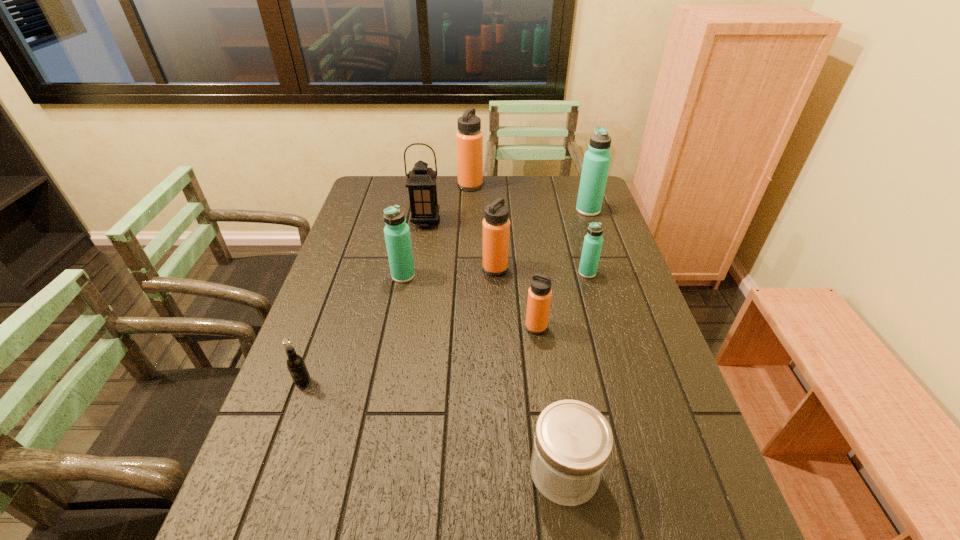
Select which thermos bottle appears as the second closest to the second smallest aqua thermos bottle. Please provide its 2D coordinates. Your answer should be formatted as a tuple, i.e. [(x, y)], where the tuple contains the x and y coordinates of a point satisfying the conditions above.

[(539, 294)]

Locate an element on the screen. This screenshot has height=540, width=960. orange thermos bottle that stands as the closest to the nearest orange thermos bottle is located at coordinates (496, 226).

I want to click on orange thermos bottle identified as the closest to the root beer, so click(539, 294).

Identify which aqua thermos bottle is the nearest to the second farthest thermos bottle. Please provide its 2D coordinates. Your answer should be formatted as a tuple, i.e. [(x, y)], where the tuple contains the x and y coordinates of a point satisfying the conditions above.

[(593, 241)]

Where is `aqua thermos bottle that stands as the second closest to the lantern`? aqua thermos bottle that stands as the second closest to the lantern is located at coordinates (593, 241).

The height and width of the screenshot is (540, 960). I want to click on free spot that satisfies the following two spatial constraints: 1. on the front side of the rightmost orange thermos bottle; 2. on the right side of the black lantern, so click(x=409, y=327).

Locate an element on the screen. This screenshot has width=960, height=540. vacant space that satisfies the following two spatial constraints: 1. on the front side of the lantern; 2. on the right side of the smallest aqua thermos bottle is located at coordinates (418, 273).

Locate an element on the screen. free space that satisfies the following two spatial constraints: 1. on the label of the leftmost object; 2. on the right side of the jar is located at coordinates (271, 471).

You are a GUI agent. You are given a task and a screenshot of the screen. Output one action in this format:
    pyautogui.click(x=<x>, y=<y>)
    Task: Click on the vacant space that satisfies the following two spatial constraints: 1. on the front side of the nearest object; 2. on the right side of the second farthest orange thermos bottle
    
    Given the screenshot: What is the action you would take?
    (x=503, y=471)